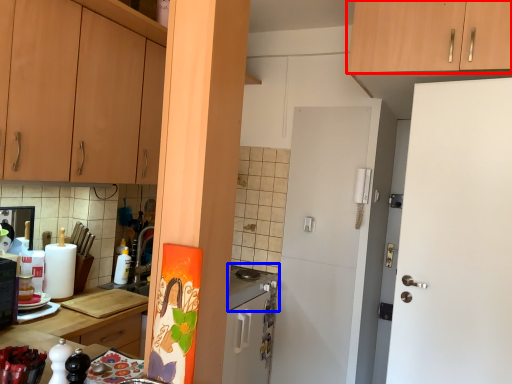
Question: Which object appears farthest to the camera in this image, cabinetry (highlighted by a red box) or gas stove (highlighted by a blue box)?

Choices:
 (A) cabinetry
 (B) gas stove

Answer: (B)